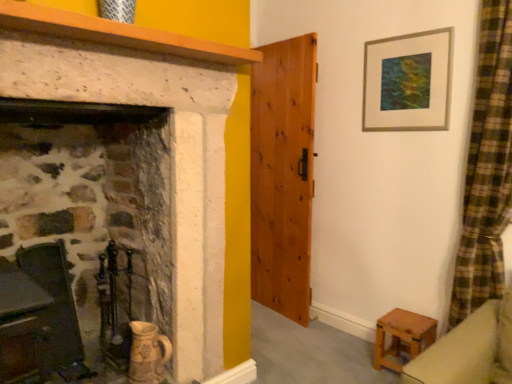
This screenshot has height=384, width=512. In order to click on blank space situated above wooden stool at lower right (from a real-world perspective) in this screenshot , I will do `click(406, 314)`.